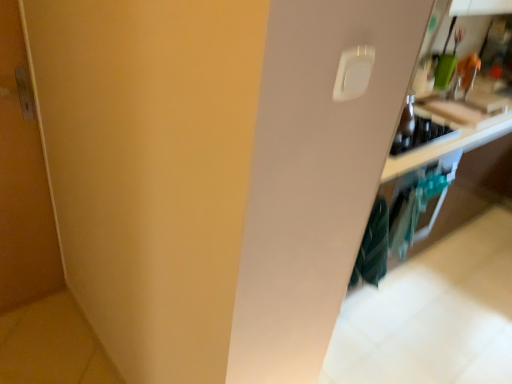
Question: Can you see teal striped fabric at lower right touching white plastic light switch at upper right?

Choices:
 (A) yes
 (B) no

Answer: (B)

Question: Is teal striped fabric at lower right at the left side of white plastic light switch at upper right?

Choices:
 (A) yes
 (B) no

Answer: (B)

Question: Can you confirm if teal striped fabric at lower right is taller than white plastic light switch at upper right?

Choices:
 (A) yes
 (B) no

Answer: (A)

Question: Considering the relative sizes of teal striped fabric at lower right and white plastic light switch at upper right in the image provided, is teal striped fabric at lower right smaller than white plastic light switch at upper right?

Choices:
 (A) no
 (B) yes

Answer: (A)

Question: Considering the relative sizes of teal striped fabric at lower right and white plastic light switch at upper right in the image provided, is teal striped fabric at lower right shorter than white plastic light switch at upper right?

Choices:
 (A) yes
 (B) no

Answer: (B)

Question: Is point (435, 110) closer or farther from the camera than point (30, 162)?

Choices:
 (A) closer
 (B) farther

Answer: (B)

Question: Is wooden cutting board at upper right inside or outside of matte wood door at left?

Choices:
 (A) inside
 (B) outside

Answer: (B)

Question: In the image, is wooden cutting board at upper right positioned in front of or behind matte wood door at left?

Choices:
 (A) front
 (B) behind

Answer: (B)

Question: Is wooden cutting board at upper right taller or shorter than matte wood door at left?

Choices:
 (A) tall
 (B) short

Answer: (B)

Question: Based on their sizes in the image, would you say white plastic light switch at upper right is bigger or smaller than wooden cutting board at upper right?

Choices:
 (A) small
 (B) big

Answer: (A)

Question: Is white plastic light switch at upper right taller or shorter than wooden cutting board at upper right?

Choices:
 (A) short
 (B) tall

Answer: (B)

Question: Would you say white plastic light switch at upper right is to the left or to the right of wooden cutting board at upper right in the picture?

Choices:
 (A) left
 (B) right

Answer: (A)

Question: Does point (365, 54) appear closer or farther from the camera than point (458, 109)?

Choices:
 (A) closer
 (B) farther

Answer: (A)

Question: Considering the positions of wooden cutting board at upper right and teal striped fabric at lower right in the image, is wooden cutting board at upper right wider or thinner than teal striped fabric at lower right?

Choices:
 (A) thin
 (B) wide

Answer: (B)

Question: Visually, is wooden cutting board at upper right positioned to the left or to the right of teal striped fabric at lower right?

Choices:
 (A) right
 (B) left

Answer: (A)